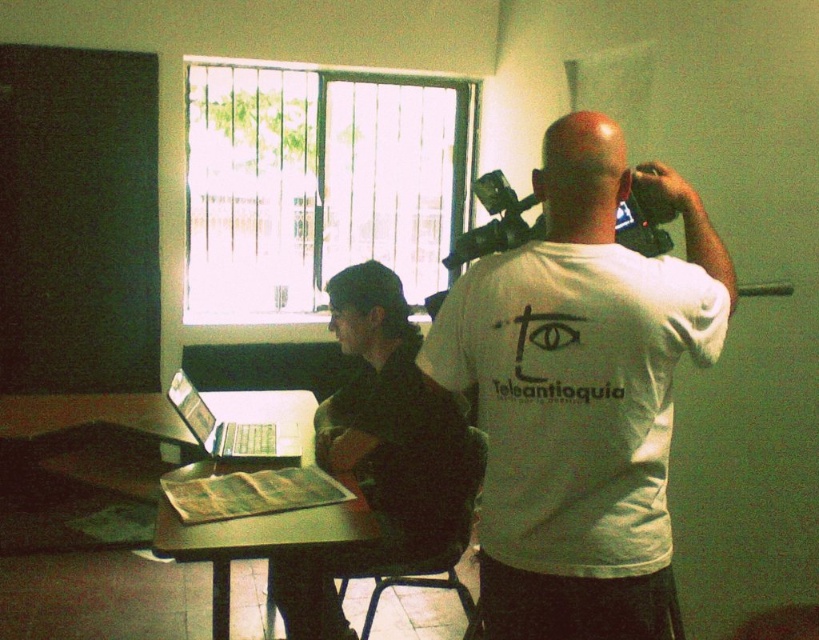
Where is the dark green fabric shirt at center located in the image?

The dark green fabric shirt at center is located at point [392,419].

You are a photographer who needs to capture a closeup shot of the dark green fabric shirt at center. The camera you have is the black plastic video camera at upper center. Can you adjust the camera to focus on the shirt without moving either object?

The distance between the dark green fabric shirt at center and the black plastic video camera at upper center is 23.62 inches. Since most cameras can focus at that distance, yes, you can adjust the camera to focus on the shirt without moving either object.